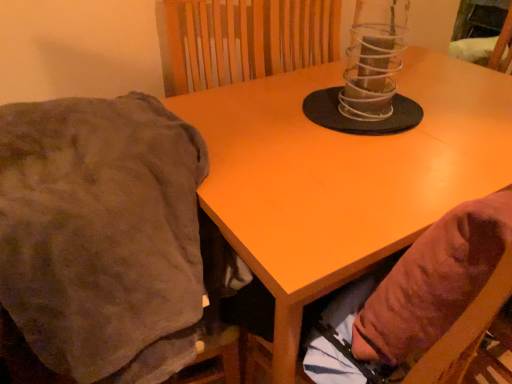
Question: From the image's perspective, relative to clear plastic candle holder at center, is brown fabric bean bag chair at lower right above or below?

Choices:
 (A) below
 (B) above

Answer: (A)

Question: Is brown fabric bean bag chair at lower right taller or shorter than clear plastic candle holder at center?

Choices:
 (A) tall
 (B) short

Answer: (A)

Question: Estimate the real-world distances between objects in this image. Which object is closer to the brown fuzzy blanket at left?

Choices:
 (A) brown fabric bean bag chair at lower right
 (B) clear plastic candle holder at center
 (C) matte orange table at center

Answer: (C)

Question: Considering the real-world distances, which object is farthest from the brown fuzzy blanket at left?

Choices:
 (A) matte orange table at center
 (B) brown fabric bean bag chair at lower right
 (C) clear plastic candle holder at center

Answer: (C)